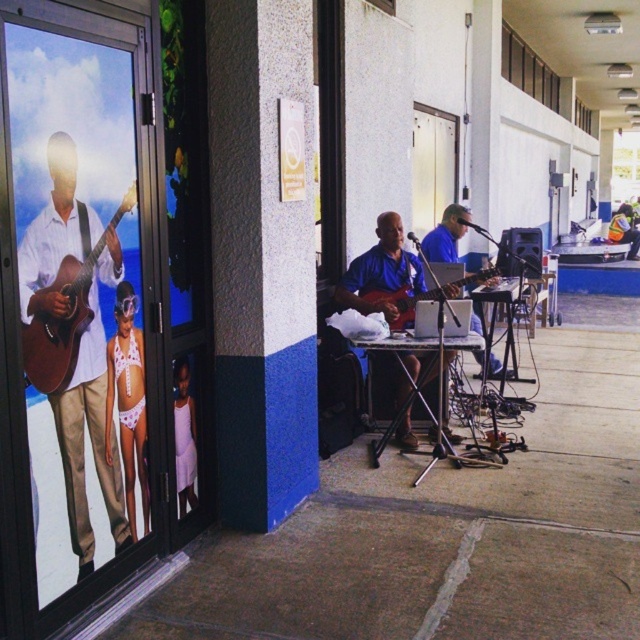
Between point (72, 346) and point (476, 328), which one is positioned in front?

Point (72, 346) is in front.

Does point (60, 342) lie behind point (456, 208)?

No, it is in front of (456, 208).

Locate an element on the screen. brown acoustic guitar at left is located at coordinates (65, 316).

Does point (122, 312) lie in front of point (632, 250)?

Yes, point (122, 312) is in front of point (632, 250).

Who is lower down, white lace bikini at left or orange reflective vest at center?

white lace bikini at left

Who is more forward, (108, 346) or (636, 241)?

Point (108, 346) is more forward.

You are a GUI agent. You are given a task and a screenshot of the screen. Output one action in this format:
    pyautogui.click(x=<x>, y=<y>)
    Task: Click on the white lace bikini at left
    
    Given the screenshot: What is the action you would take?
    pyautogui.click(x=128, y=401)

Can you confirm if matte blue guitar at center is thinner than white lace bikini at left?

In fact, matte blue guitar at center might be wider than white lace bikini at left.

Which is below, matte blue guitar at center or white lace bikini at left?

white lace bikini at left

Is point (344, 280) behind point (108, 422)?

Yes.

Image resolution: width=640 pixels, height=640 pixels. In order to click on matte blue guitar at center in this screenshot , I will do `click(381, 272)`.